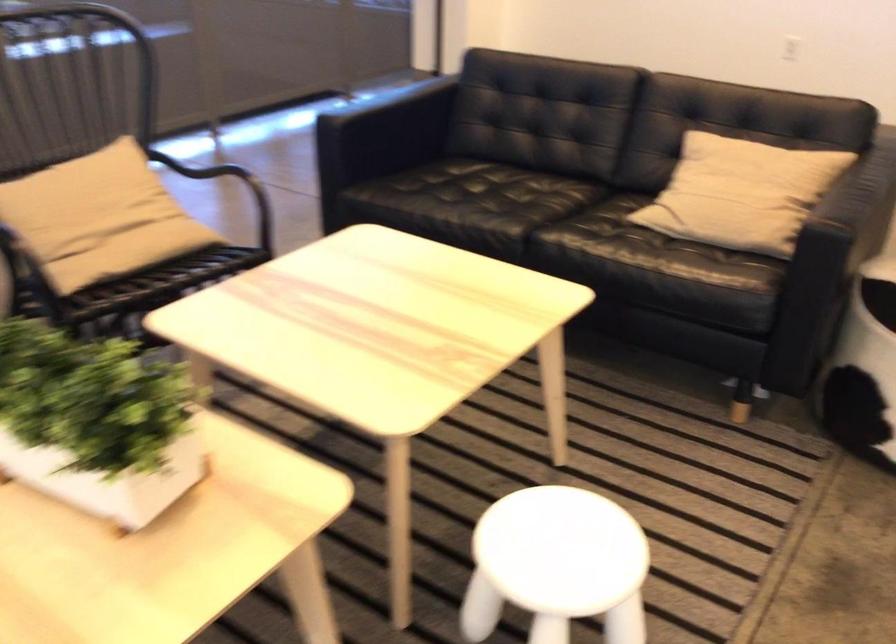
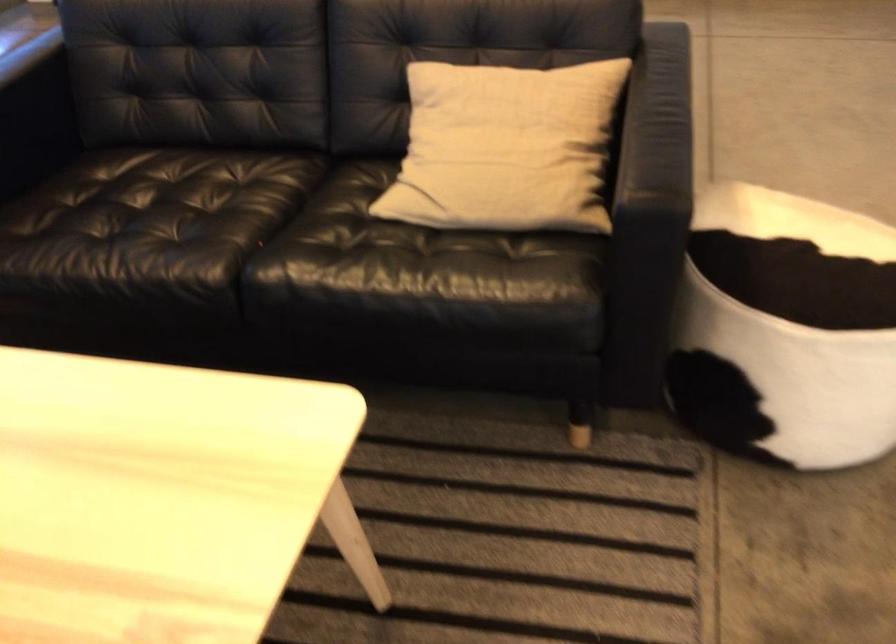
Question: Which direction would the cameraman need to move to produce the second image? Reply with the corresponding letter.

Choices:
 (A) Left
 (B) Right
 (C) Forward
 (D) Backward

Answer: (C)